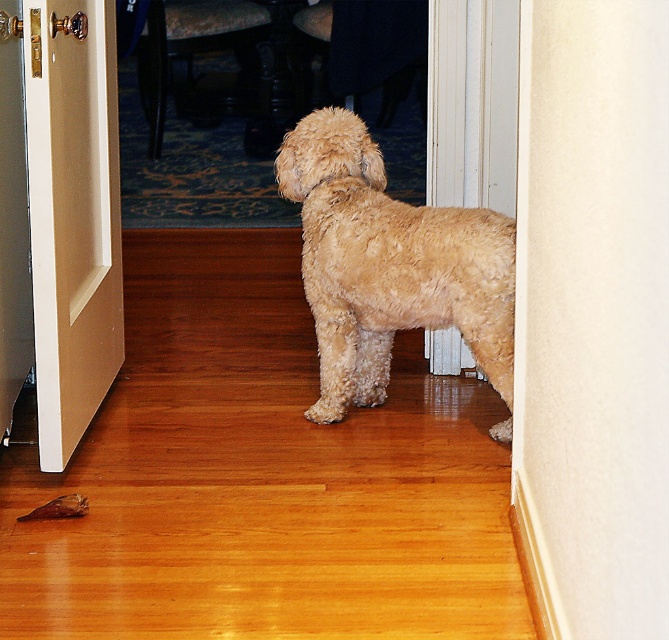
Does fuzzy beige dog at center lie behind beige wood door at left?

That is True.

Which of these two, fuzzy beige dog at center or beige wood door at left, stands shorter?

With less height is fuzzy beige dog at center.

This screenshot has height=640, width=669. Describe the element at coordinates (387, 264) in the screenshot. I see `fuzzy beige dog at center` at that location.

You are a GUI agent. You are given a task and a screenshot of the screen. Output one action in this format:
    pyautogui.click(x=<x>, y=<y>)
    Task: Click on the fuzzy beige dog at center
    Image resolution: width=669 pixels, height=640 pixels.
    Given the screenshot: What is the action you would take?
    (387, 264)